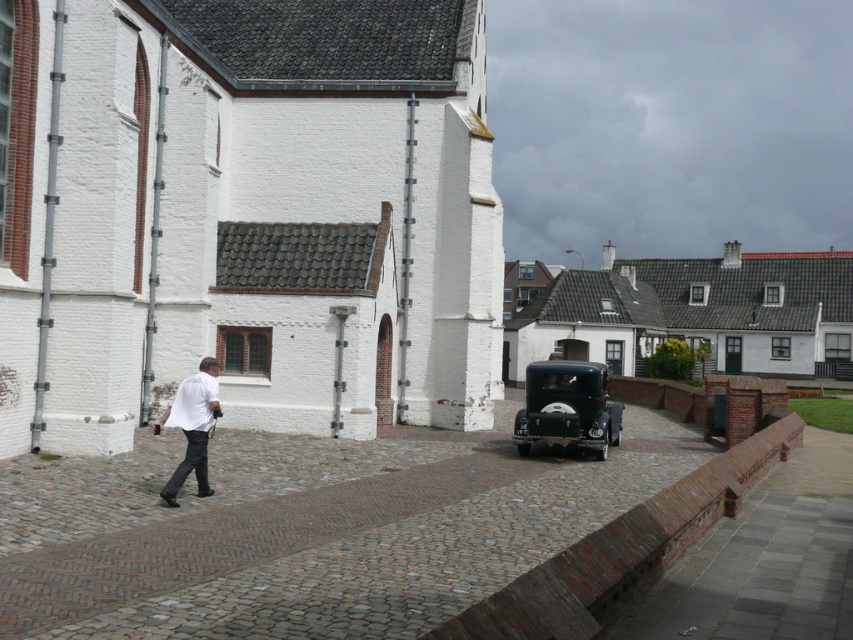
Is brown cobblestone pavement at center taller than shiny black car at center?

No.

Is brown cobblestone pavement at center below shiny black car at center?

Yes, brown cobblestone pavement at center is below shiny black car at center.

Find the location of `brown cobblestone pavement at center`. brown cobblestone pavement at center is located at coordinates (306, 529).

You are a GUI agent. You are given a task and a screenshot of the screen. Output one action in this format:
    pyautogui.click(x=<x>, y=<y>)
    Task: Click on the brown cobblestone pavement at center
    
    Given the screenshot: What is the action you would take?
    pyautogui.click(x=306, y=529)

Can you confirm if shiny black car at center is positioned to the left of white matte shirt at lower left?

Incorrect, shiny black car at center is not on the left side of white matte shirt at lower left.

Can you confirm if shiny black car at center is bigger than white matte shirt at lower left?

Yes, shiny black car at center is bigger than white matte shirt at lower left.

Where is `shiny black car at center`? shiny black car at center is located at coordinates (567, 406).

Is brown cobblestone pavement at center taller than white matte shirt at lower left?

Incorrect, brown cobblestone pavement at center's height is not larger of white matte shirt at lower left's.

Is brown cobblestone pavement at center smaller than white matte shirt at lower left?

No, brown cobblestone pavement at center is not smaller than white matte shirt at lower left.

Does point (428, 436) lie behind point (192, 426)?

Yes, point (428, 436) is behind point (192, 426).

This screenshot has height=640, width=853. Identify the location of brown cobblestone pavement at center. (306, 529).